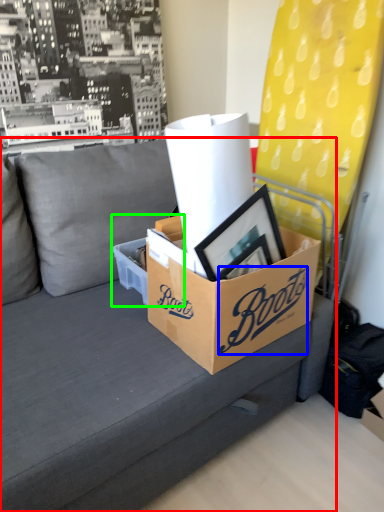
Question: Considering the real-world distances, which object is closest to studio couch (highlighted by a red box)? writing (highlighted by a blue box) or box (highlighted by a green box).

Choices:
 (A) writing
 (B) box

Answer: (B)